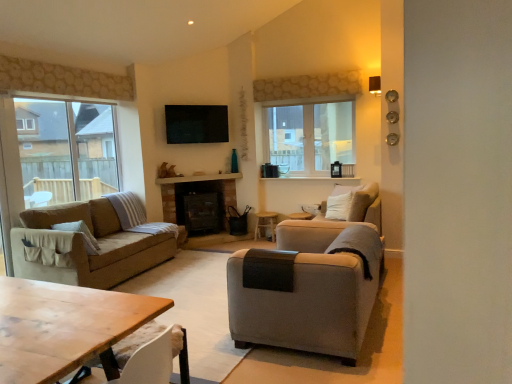
Question: Considering the relative positions of transparent glass screen door at left and light gray fabric armchair at right in the image provided, is transparent glass screen door at left to the left or to the right of light gray fabric armchair at right?

Choices:
 (A) left
 (B) right

Answer: (A)

Question: Considering the positions of transparent glass screen door at left and light gray fabric armchair at right in the image, is transparent glass screen door at left bigger or smaller than light gray fabric armchair at right?

Choices:
 (A) small
 (B) big

Answer: (A)

Question: Which of these objects is positioned closest to the light gray fabric armchair at center?

Choices:
 (A) transparent glass screen door at left
 (B) wooden side table at center
 (C) wooden table at lower left
 (D) clear glass window at center, which appears as the 2th window when viewed from the front
 (E) light gray fabric armchair at right

Answer: (E)

Question: Which object is the closest to the wooden side table at center?

Choices:
 (A) wooden table at lower left
 (B) light gray fabric armchair at right
 (C) clear glass window at center, which is the first window from back to front
 (D) clear glass window at left, placed as the 2th window when sorted from right to left
 (E) transparent glass screen door at left

Answer: (C)